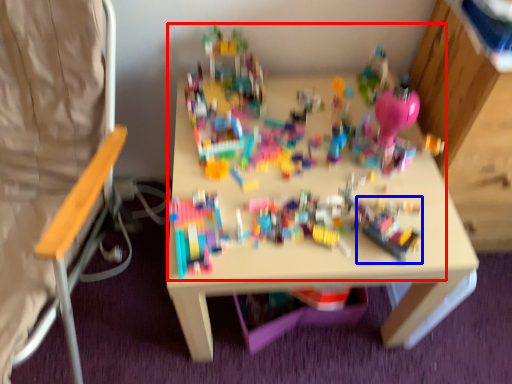
Question: Which object is closer to the camera taking this photo, toy (highlighted by a red box) or toy (highlighted by a blue box)?

Choices:
 (A) toy
 (B) toy

Answer: (A)